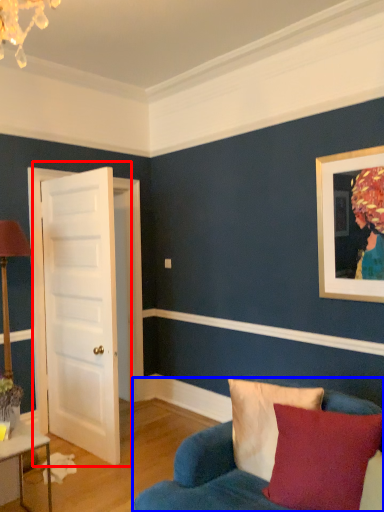
Question: Which object is further to the camera taking this photo, door (highlighted by a red box) or studio couch (highlighted by a blue box)?

Choices:
 (A) door
 (B) studio couch

Answer: (A)